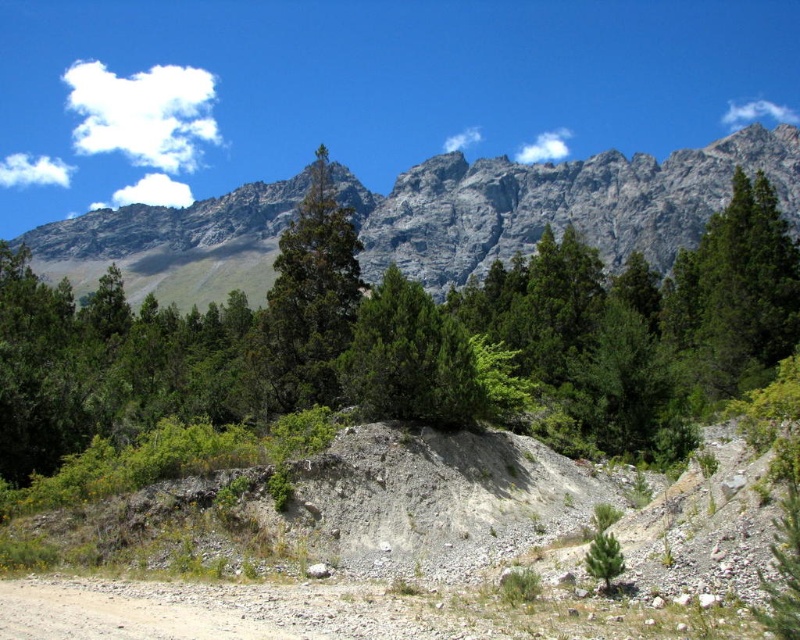
Looking at this image, is green textured tree at upper center positioned before green matte tree at center?

Yes, green textured tree at upper center is closer to the viewer.

Locate an element on the screen. green textured tree at upper center is located at coordinates (409, 340).

Where is `green textured tree at upper center`? green textured tree at upper center is located at coordinates (409, 340).

Locate an element on the screen. The height and width of the screenshot is (640, 800). green textured tree at upper center is located at coordinates (409, 340).

Is gray rock mountain at upper center below green matte tree at center?

Incorrect, gray rock mountain at upper center is not positioned below green matte tree at center.

Is point (641, 236) more distant than point (325, 282)?

Yes, point (641, 236) is farther from viewer.

Locate an element on the screen. This screenshot has height=640, width=800. gray rock mountain at upper center is located at coordinates (558, 204).

This screenshot has width=800, height=640. Describe the element at coordinates (409, 340) in the screenshot. I see `green textured tree at upper center` at that location.

Which is behind, point (596, 332) or point (618, 209)?

The point (618, 209) is more distant.

Based on the photo, who is more forward, (110, 349) or (408, 237)?

Point (110, 349) is more forward.

Where is `green textured tree at upper center`? green textured tree at upper center is located at coordinates (409, 340).